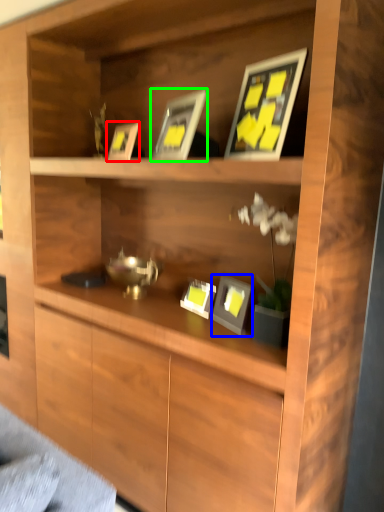
Question: Estimate the real-world distances between objects in this image. Which object is closer to picture frame (highlighted by a red box), picture frame (highlighted by a blue box) or picture frame (highlighted by a green box)?

Choices:
 (A) picture frame
 (B) picture frame

Answer: (B)